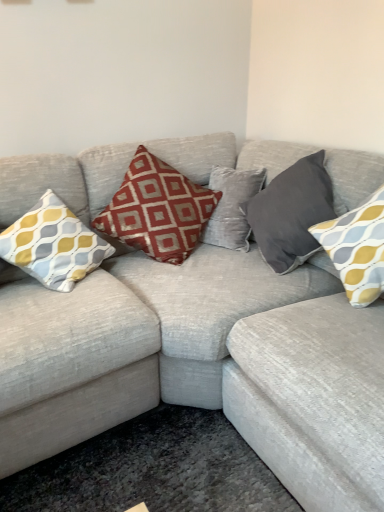
Question: Is textured gray couch at center next to yellow-grey patterned cushion at left, which ranks as the first pillow in left-to-right order?

Choices:
 (A) yes
 (B) no

Answer: (B)

Question: Is textured gray couch at center positioned in front of yellow-grey patterned cushion at left, the 4th pillow viewed from the right?

Choices:
 (A) yes
 (B) no

Answer: (A)

Question: Can you confirm if textured gray couch at center is thinner than yellow-grey patterned cushion at left, which ranks as the first pillow in left-to-right order?

Choices:
 (A) no
 (B) yes

Answer: (A)

Question: Can you confirm if textured gray couch at center is taller than yellow-grey patterned cushion at left, the 4th pillow viewed from the right?

Choices:
 (A) no
 (B) yes

Answer: (B)

Question: Can you confirm if textured gray couch at center is shorter than yellow-grey patterned cushion at left, the 4th pillow viewed from the right?

Choices:
 (A) no
 (B) yes

Answer: (A)

Question: Would you say yellow-grey patterned pillow at right, which is the 4th pillow from left to right, is to the left or to the right of dark gray velvet pillow at upper right, which is the third pillow in left-to-right order, in the picture?

Choices:
 (A) right
 (B) left

Answer: (A)

Question: From a real-world perspective, is yellow-grey patterned pillow at right, which is the 4th pillow from left to right, physically located above or below dark gray velvet pillow at upper right, which is the third pillow in left-to-right order?

Choices:
 (A) below
 (B) above

Answer: (B)

Question: Considering their positions, is yellow-grey patterned pillow at right, which is the 4th pillow from left to right, located in front of or behind dark gray velvet pillow at upper right, which is the third pillow in left-to-right order?

Choices:
 (A) front
 (B) behind

Answer: (A)

Question: Is point (377, 266) positioned closer to the camera than point (307, 207)?

Choices:
 (A) farther
 (B) closer

Answer: (B)

Question: Is dark gray velvet pillow at upper right, which appears as the second pillow when viewed from the right, in front of or behind textured gray couch at center in the image?

Choices:
 (A) front
 (B) behind

Answer: (B)

Question: In terms of height, does dark gray velvet pillow at upper right, which is the third pillow in left-to-right order, look taller or shorter compared to textured gray couch at center?

Choices:
 (A) short
 (B) tall

Answer: (A)

Question: Would you say dark gray velvet pillow at upper right, which is the third pillow in left-to-right order, is to the left or to the right of textured gray couch at center in the picture?

Choices:
 (A) left
 (B) right

Answer: (B)

Question: Considering the positions of dark gray velvet pillow at upper right, which appears as the second pillow when viewed from the right, and textured gray couch at center in the image, is dark gray velvet pillow at upper right, which appears as the second pillow when viewed from the right, wider or thinner than textured gray couch at center?

Choices:
 (A) thin
 (B) wide

Answer: (A)

Question: From the image's perspective, is yellow-grey patterned cushion at left, which ranks as the first pillow in left-to-right order, positioned above or below red printed cushion at center, the 3th pillow from the right?

Choices:
 (A) above
 (B) below

Answer: (B)

Question: Considering the positions of yellow-grey patterned cushion at left, the 4th pillow viewed from the right, and red printed cushion at center, which is the 2th pillow from left to right, in the image, is yellow-grey patterned cushion at left, the 4th pillow viewed from the right, wider or thinner than red printed cushion at center, which is the 2th pillow from left to right,?

Choices:
 (A) thin
 (B) wide

Answer: (A)